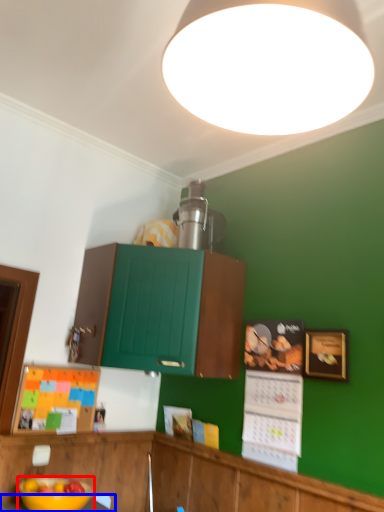
Question: Which object is closer to the camera taking this photo, bowl (highlighted by a red box) or table (highlighted by a blue box)?

Choices:
 (A) bowl
 (B) table

Answer: (B)